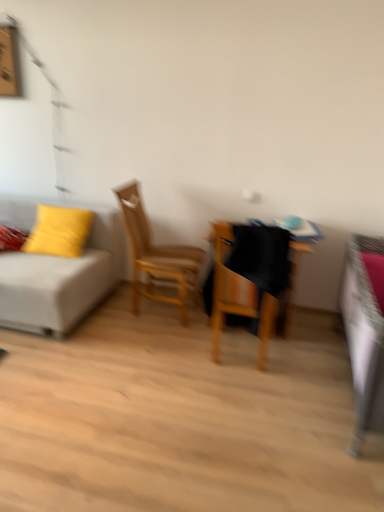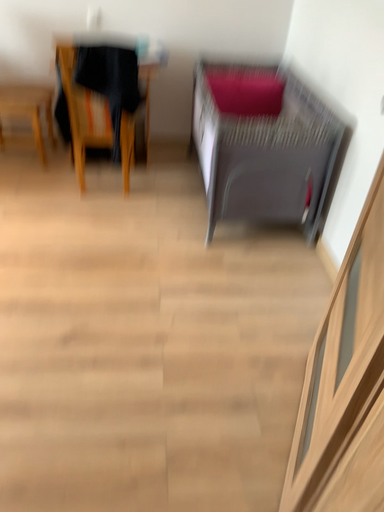
Question: Which way did the camera rotate in the video?

Choices:
 (A) rotated upward
 (B) rotated downward

Answer: (B)